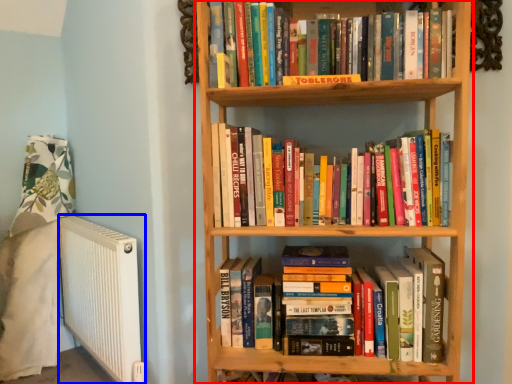
Question: Which point is further to the camera, bookcase (highlighted by a red box) or radiator (highlighted by a blue box)?

Choices:
 (A) bookcase
 (B) radiator

Answer: (B)